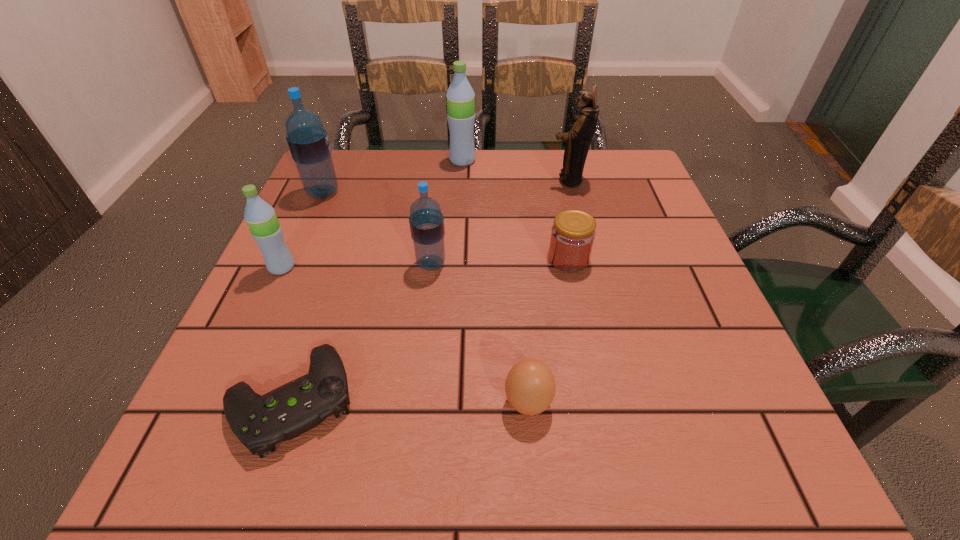
Image resolution: width=960 pixels, height=540 pixels. I want to click on free space between the farther green water bottle and the bigger blue water bottle, so click(x=393, y=177).

Identify the location of empty space between the control and the right green water bottle. (377, 280).

At what (x,y) coordinates should I click in order to perform the action: click on vacant region between the right blue water bottle and the figurine. Please return your answer as a coordinate pair (x, y). Looking at the image, I should click on (499, 221).

You are a GUI agent. You are given a task and a screenshot of the screen. Output one action in this format:
    pyautogui.click(x=<x>, y=<y>)
    Task: Click on the vacant space that's between the sixth object from left to right and the red jam
    This screenshot has height=540, width=960.
    Given the screenshot: What is the action you would take?
    pyautogui.click(x=548, y=330)

At what (x,y) coordinates should I click in order to perform the action: click on vacant region between the figurine and the third object from right to left. Please return your answer as a coordinate pair (x, y). The image size is (960, 540). Looking at the image, I should click on (x=548, y=291).

I want to click on free space between the left green water bottle and the nearer blue water bottle, so click(356, 265).

Locate an element on the screen. object that can be found as the second closest to the bigger green water bottle is located at coordinates (308, 142).

Identify which object is located as the fourth nearest to the red jam. Please provide its 2D coordinates. Your answer should be formatted as a tuple, i.e. [(x, y)], where the tuple contains the x and y coordinates of a point satisfying the conditions above.

[(460, 96)]

Identify which water bottle is the second nearest to the figurine. Please provide its 2D coordinates. Your answer should be formatted as a tuple, i.e. [(x, y)], where the tuple contains the x and y coordinates of a point satisfying the conditions above.

[(426, 221)]

Identify which water bottle is the fourth nearest to the red jam. Please provide its 2D coordinates. Your answer should be formatted as a tuple, i.e. [(x, y)], where the tuple contains the x and y coordinates of a point satisfying the conditions above.

[(260, 217)]